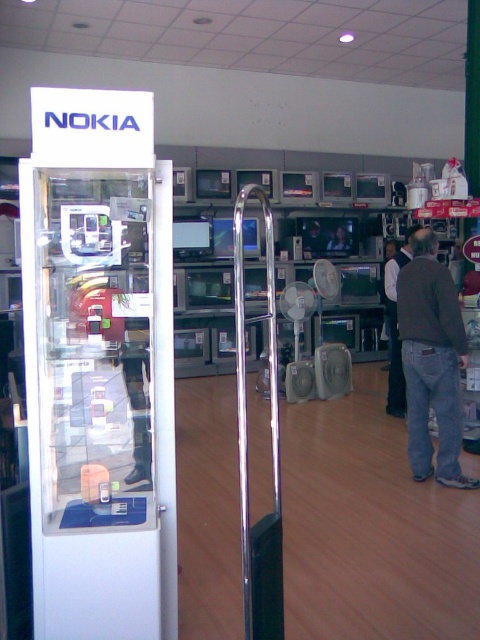
You are a customer in the electronics store and want to know which item is bigger between the brown denim jacket at lower right and the smooth plastic tv at center. Can you tell me?

The brown denim jacket at lower right is larger in size than the smooth plastic tv at center.

You are a customer in the electronics store looking for the smooth plastic tv at center. You see the brown denim jacket at lower right. Is the jacket positioned below the TV?

Yes, the brown denim jacket at lower right is located below the smooth plastic tv at center according to the description.

You are a customer in the electronics store looking for a TV. You see the smooth plastic tv at center and the brown denim jacket at lower right. Which item is located to the right of the other?

The brown denim jacket at lower right is to the right of the smooth plastic tv at center.